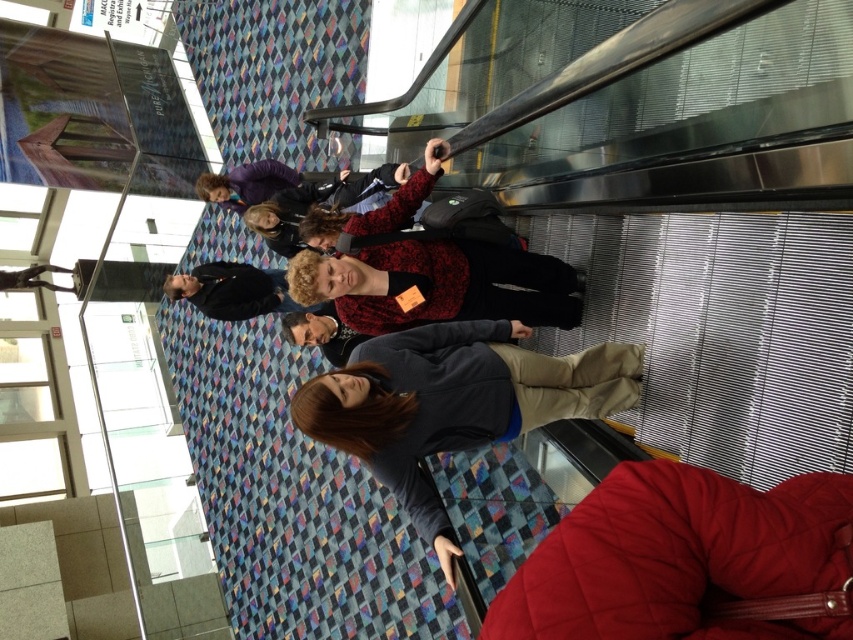
Which is in front, point (517, 422) or point (109, 288)?

Point (517, 422) is more forward.

In the scene shown: Who is more distant from viewer, (585, 385) or (160, 266)?

Positioned behind is point (160, 266).

This screenshot has height=640, width=853. I want to click on dark gray fleece jacket at center, so click(x=454, y=403).

This screenshot has width=853, height=640. Describe the element at coordinates (234, 291) in the screenshot. I see `black jacket at center` at that location.

Is black jacket at center positioned behind metal statue at left?

No, black jacket at center is closer to the viewer.

Is point (173, 282) behind point (115, 285)?

No, (173, 282) is closer to viewer.

The width and height of the screenshot is (853, 640). Identify the location of black jacket at center. (234, 291).

Does matte red sweater at center have a greater width compared to metal statue at left?

Yes, matte red sweater at center is wider than metal statue at left.

Between matte red sweater at center and metal statue at left, which one appears on the right side from the viewer's perspective?

matte red sweater at center

Who is more forward, [360,330] or [160,269]?

Point [360,330] is in front.

Identify the location of matte red sweater at center. (438, 284).